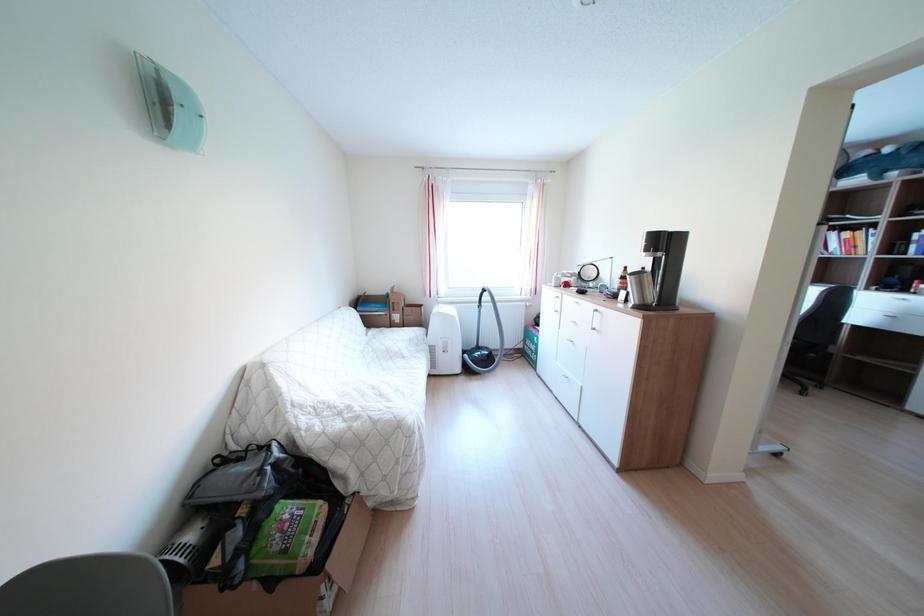
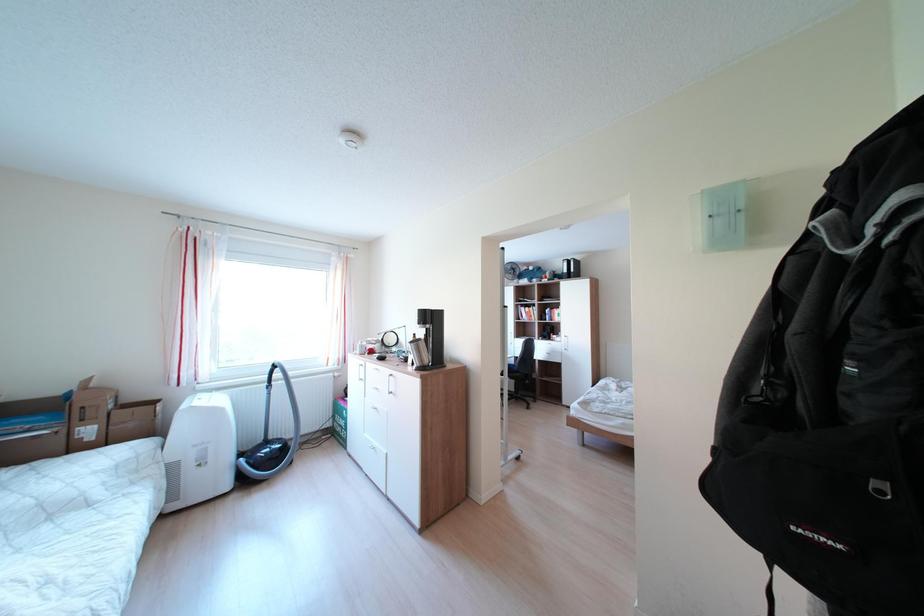
Question: The camera is either moving clockwise (left) or counter-clockwise (right) around the object. The first image is from the beginning of the video and the second image is from the end. Is the camera moving left or right when shooting the video?

Choices:
 (A) Left
 (B) Right

Answer: (A)